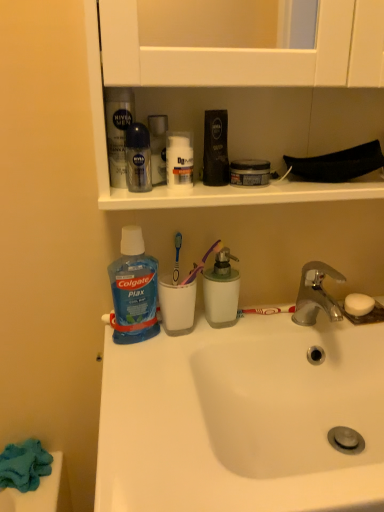
Where is `vacant space to the left of white matte soap at right`? The width and height of the screenshot is (384, 512). vacant space to the left of white matte soap at right is located at coordinates (298, 322).